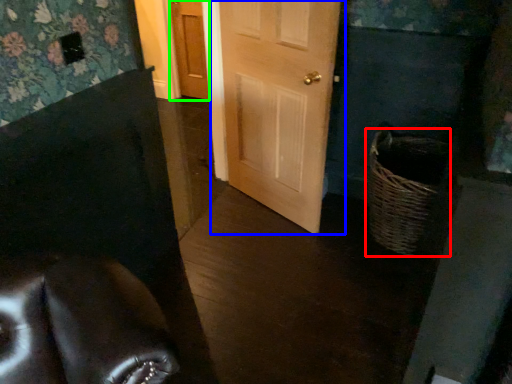
Question: Which object is the farthest from basket (highlighted by a red box)? Choose among these: door (highlighted by a blue box) or door (highlighted by a green box).

Choices:
 (A) door
 (B) door

Answer: (B)